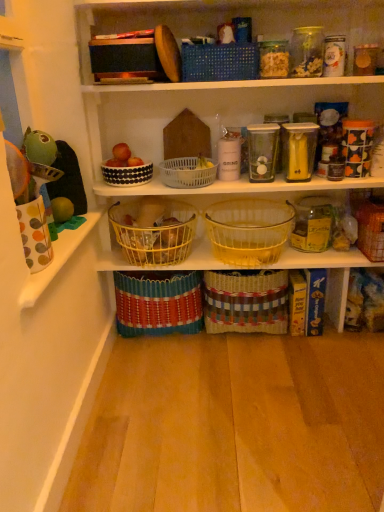
Question: In terms of width, does white plastic basket at center, the third basket from the top, look wider or thinner when compared to woven fabric basket at center, positioned as the 8th basket in top-to-bottom order?

Choices:
 (A) wide
 (B) thin

Answer: (B)

Question: In terms of height, does white plastic basket at center, the third basket from the top, look taller or shorter compared to woven fabric basket at center, which is the first basket in bottom-to-top order?

Choices:
 (A) tall
 (B) short

Answer: (B)

Question: Which object is positioned farthest from the transparent glass container at center, arranged as the 1th glass jar when viewed from the front?

Choices:
 (A) translucent glass jar at center right, which ranks as the first glass jar in bottom-to-top order
 (B) blue woven basket at upper center, the 8th basket positioned from the bottom
 (C) translucent glass basket at center, marked as the fourth basket in a top-to-bottom arrangement
 (D) white plastic basket at center, the 6th basket positioned from the bottom
 (E) black dotted bowl at upper center, which is counted as the second basket, starting from the top

Answer: (E)

Question: Estimate the real-world distances between objects in this image. Which object is farther from the yellow wire basket at center, which is the 3th basket in bottom-to-top order?

Choices:
 (A) transparent glass container at center, arranged as the 2th glass jar when ordered from the bottom
 (B) white plastic basket at center, the third basket from the top
 (C) blue woven basket at upper center, the 8th basket positioned from the bottom
 (D) woven brown basket at lower right, marked as the fifth basket in a top-to-bottom arrangement
 (E) translucent glass basket at center, which is counted as the fifth basket, starting from the bottom

Answer: (D)